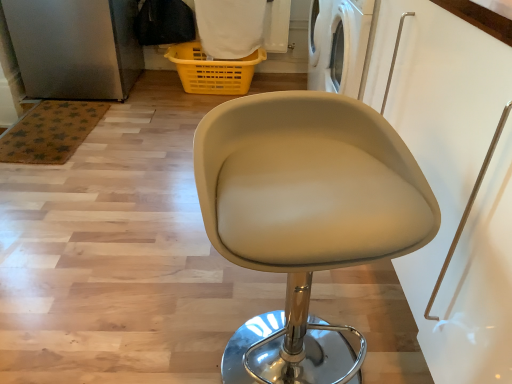
Question: From their relative heights in the image, would you say yellow plastic basket at upper center is taller or shorter than beige leather stool at center?

Choices:
 (A) short
 (B) tall

Answer: (A)

Question: Considering the positions of point (206, 74) and point (281, 115), is point (206, 74) closer or farther from the camera than point (281, 115)?

Choices:
 (A) closer
 (B) farther

Answer: (B)

Question: From the image's perspective, is yellow plastic basket at upper center above or below beige leather stool at center?

Choices:
 (A) below
 (B) above

Answer: (B)

Question: In terms of size, does beige leather stool at center appear bigger or smaller than yellow plastic basket at upper center?

Choices:
 (A) small
 (B) big

Answer: (B)

Question: From a real-world perspective, relative to yellow plastic basket at upper center, is beige leather stool at center vertically above or below?

Choices:
 (A) above
 (B) below

Answer: (A)

Question: Is beige leather stool at center taller or shorter than yellow plastic basket at upper center?

Choices:
 (A) short
 (B) tall

Answer: (B)

Question: In the image, is beige leather stool at center positioned in front of or behind yellow plastic basket at upper center?

Choices:
 (A) front
 (B) behind

Answer: (A)